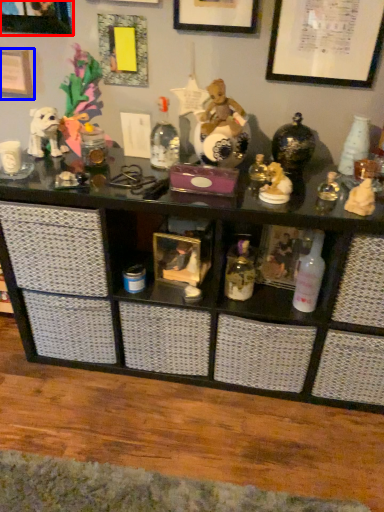
Question: Which object is closer to the camera taking this photo, picture frame (highlighted by a red box) or picture frame (highlighted by a blue box)?

Choices:
 (A) picture frame
 (B) picture frame

Answer: (A)